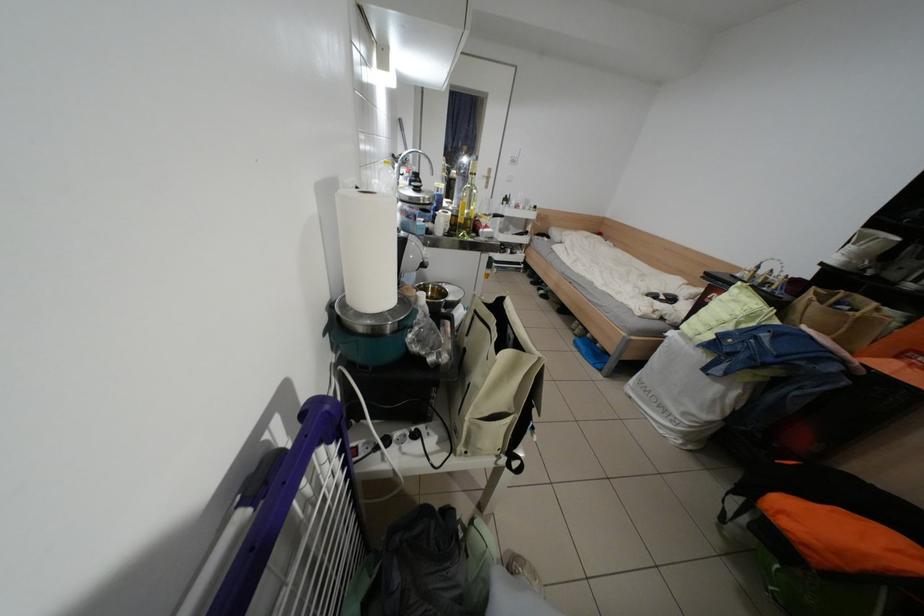
What do you see at coordinates (400, 176) in the screenshot? This screenshot has height=616, width=924. I see `the faucet handle` at bounding box center [400, 176].